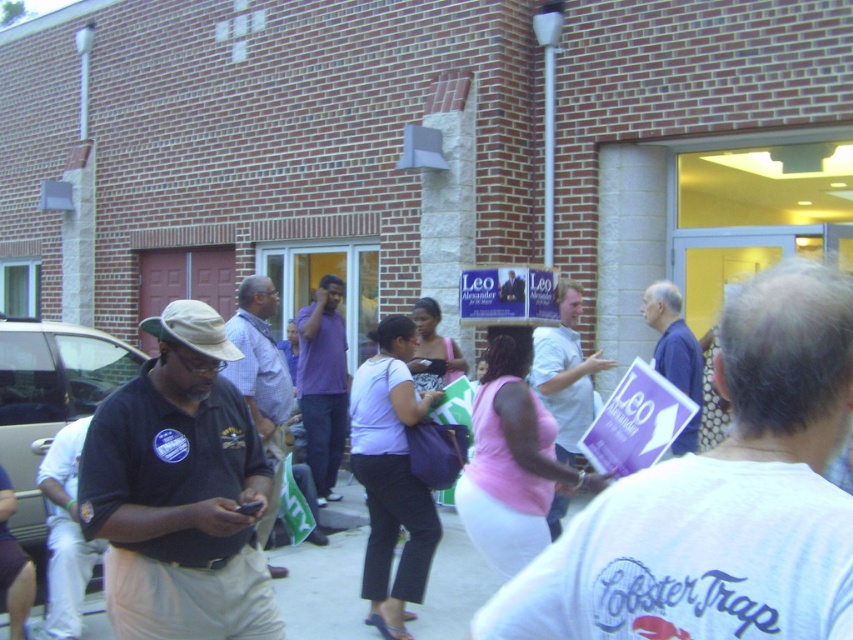
You are a photographer at the event and want to capture a clear photo of both the purple matte shirt at center and the blue paper sign at center. Based on their positions, which object should you focus on first to ensure both are in the frame?

The blue paper sign at center is behind the purple matte shirt at center, so you should focus on the purple matte shirt at center first to ensure both are visible in the photo.